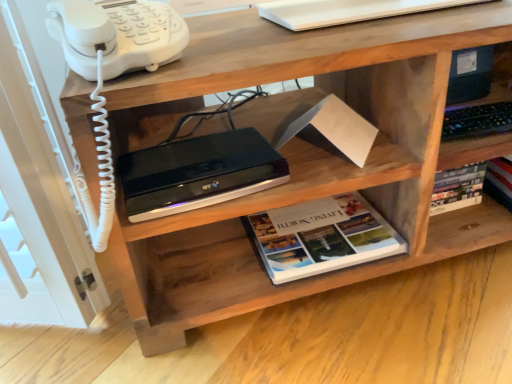
Question: In terms of size, does white plastic phone at upper left appear bigger or smaller than hardcover book at center?

Choices:
 (A) small
 (B) big

Answer: (A)

Question: In the image, is white plastic phone at upper left positioned in front of or behind hardcover book at center?

Choices:
 (A) behind
 (B) front

Answer: (B)

Question: Which object is the farthest from the white plastic phone at upper left?

Choices:
 (A) black plastic printer at upper center
 (B) hardcover book at center

Answer: (B)

Question: Considering the real-world distances, which object is closest to the black plastic printer at upper center?

Choices:
 (A) white plastic phone at upper left
 (B) hardcover book at center

Answer: (A)